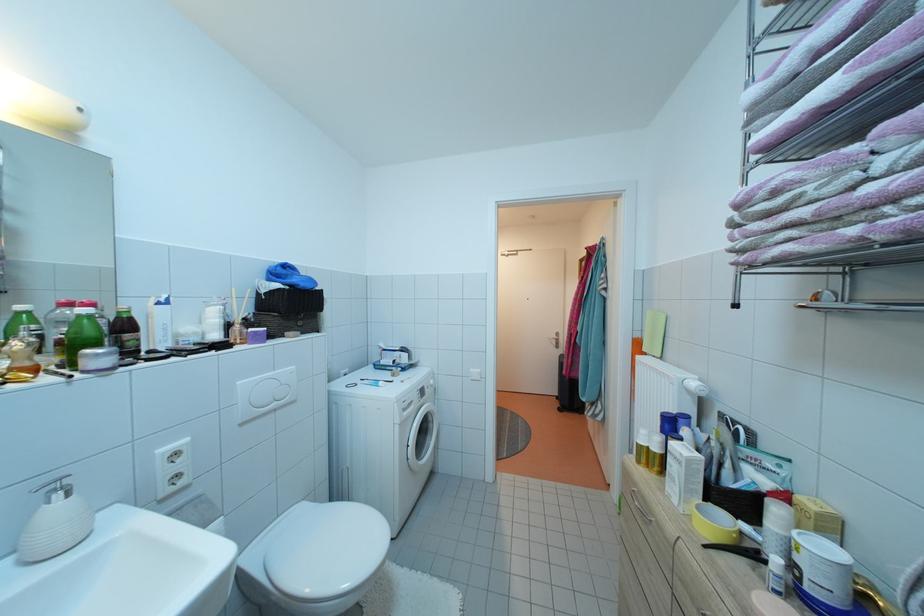
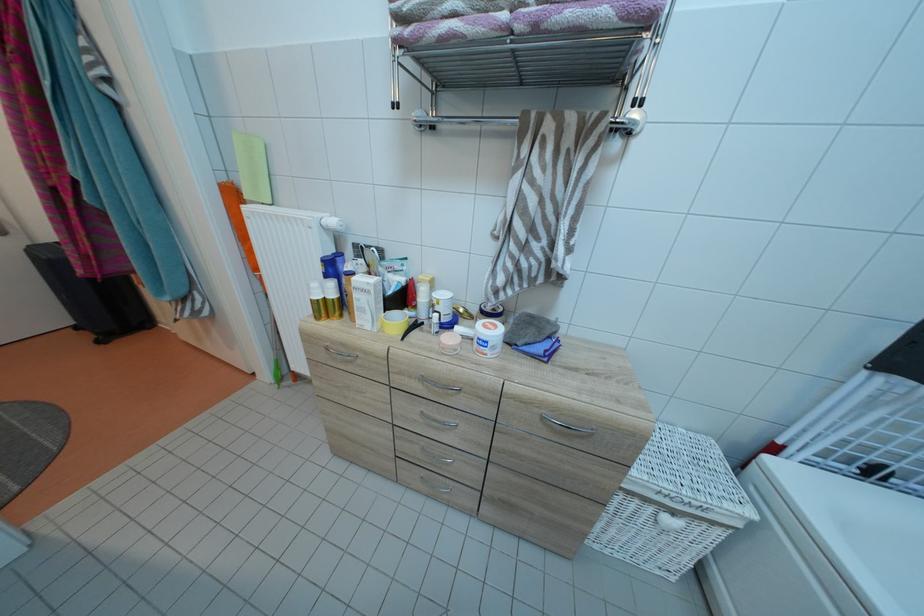
The images are taken continuously from a first-person perspective. In which direction is your viewpoint rotating?

The camera's rotation is toward right-down.